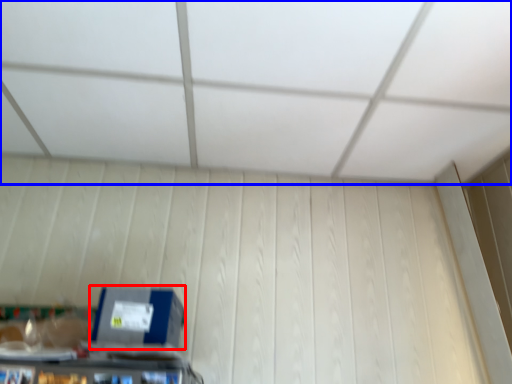
Question: Which point is closer to the camera, box (highlighted by a red box) or exhaust hood (highlighted by a blue box)?

Choices:
 (A) box
 (B) exhaust hood

Answer: (B)